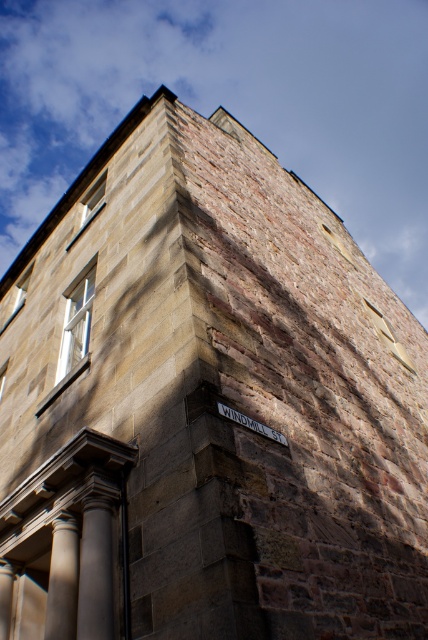
Question: Which of the following is the farthest from the observer?

Choices:
 (A) (264, 428)
 (B) (104, 600)

Answer: (A)

Question: Which point is farther to the camera?

Choices:
 (A) (76, 536)
 (B) (220, 403)

Answer: (A)

Question: Is dark gray stone column at lower left above smooth stone column at lower left?

Choices:
 (A) yes
 (B) no

Answer: (A)

Question: Can you confirm if smooth stone column at lower left is positioned to the right of metallic street sign at upper right?

Choices:
 (A) yes
 (B) no

Answer: (B)

Question: Considering the real-world distances, which object is closest to the metallic street sign at upper right?

Choices:
 (A) dark gray stone column at lower left
 (B) smooth stone column at lower left

Answer: (A)

Question: Is dark gray stone column at lower left positioned behind smooth stone column at lower left?

Choices:
 (A) no
 (B) yes

Answer: (A)